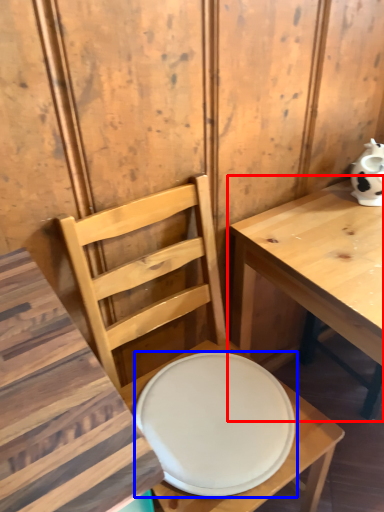
Question: Which object appears closest to the camera in this image, table (highlighted by a red box) or plate (highlighted by a blue box)?

Choices:
 (A) table
 (B) plate

Answer: (A)